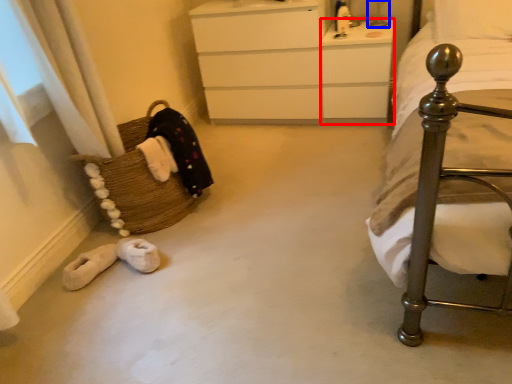
Question: Among these objects, which one is farthest to the camera, vanity (highlighted by a red box) or table lamp (highlighted by a blue box)?

Choices:
 (A) vanity
 (B) table lamp

Answer: (B)